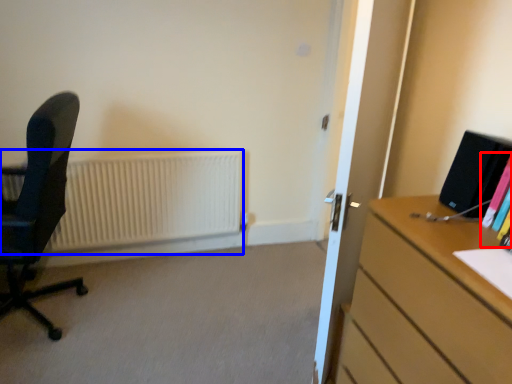
Question: Which of the following is the farthest to the observer, book (highlighted by a red box) or radiator (highlighted by a blue box)?

Choices:
 (A) book
 (B) radiator

Answer: (B)